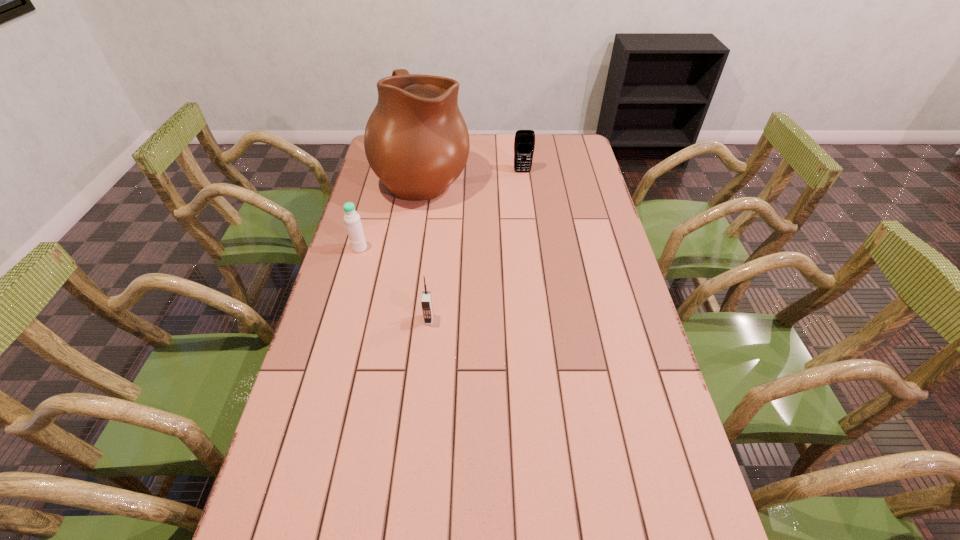
Find the location of `free space between the farther cellular telephone and the water bottle`. free space between the farther cellular telephone and the water bottle is located at coordinates (441, 210).

Identify the location of free space between the farther cellular telephone and the second nearest object. This screenshot has width=960, height=540. (441, 210).

I want to click on the third closest object to the left cellular telephone, so click(524, 143).

Identify which object is the nearest to the farther cellular telephone. Please provide its 2D coordinates. Your answer should be formatted as a tuple, i.e. [(x, y)], where the tuple contains the x and y coordinates of a point satisfying the conditions above.

[(416, 141)]

At what (x,y) coordinates should I click in order to perform the action: click on blank area in the image that satisfies the following two spatial constraints: 1. on the screen of the rightmost object; 2. at the spout of the cream pitcher. Please return your answer as a coordinate pair (x, y). This screenshot has width=960, height=540. Looking at the image, I should click on (523, 177).